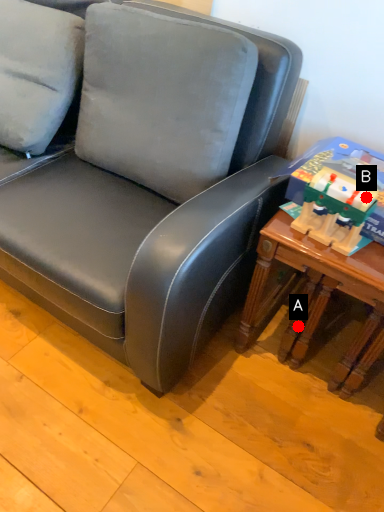
Question: Two points are circled on the image, labeled by A and B beside each circle. Among these points, which one is nearest to the camera?

Choices:
 (A) A is closer
 (B) B is closer

Answer: (B)